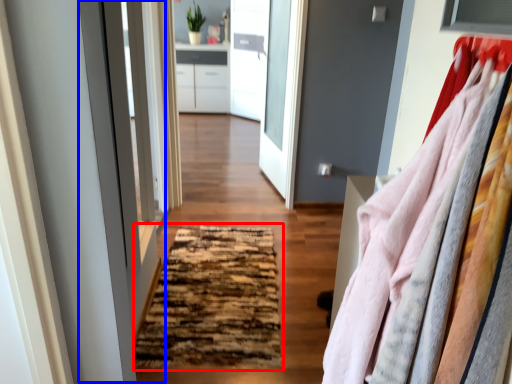
Question: Which of the following is the closest to the observer, mat (highlighted by a red box) or screen door (highlighted by a blue box)?

Choices:
 (A) mat
 (B) screen door

Answer: (B)